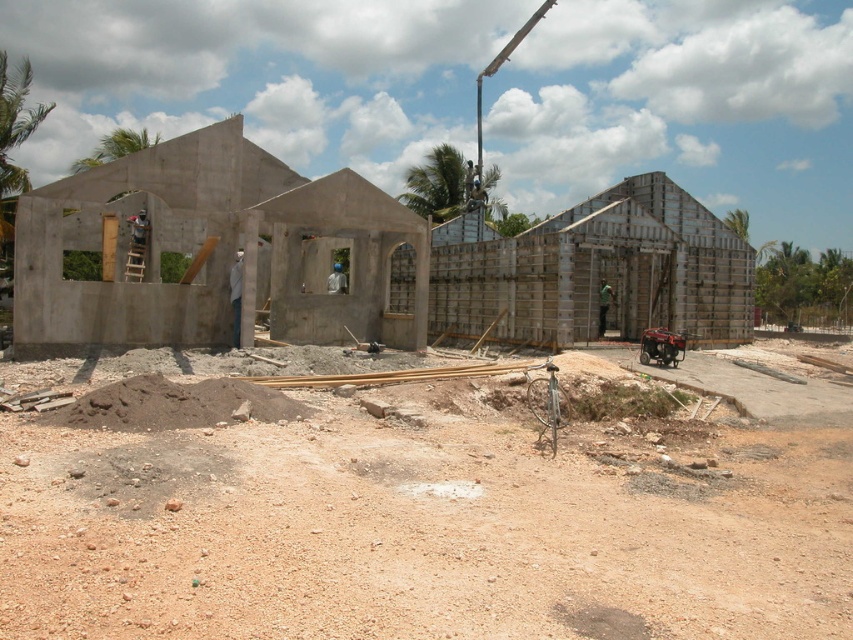
You are a construction worker who needs to move a heavy equipment from the brown gravel at lower center to the smooth concrete building at center. Considering the size of the gravel and the building, which location would provide a more stable base for the equipment?

The smooth concrete building at center is larger than the brown gravel at lower center, so the equipment would be more stable on the smooth concrete building at center.

You are a delivery driver who needs to park your truck near the construction site. The truck requires a flat, stable area free of loose materials. Based on the scene, where should you park your truck to avoid the brown gravel at lower center and the green fabric construction worker at center?

The green fabric construction worker at center is smaller than the brown gravel at lower center. Therefore, parking near the green fabric construction worker at center would provide a flatter and more stable area since it occupies less space and the gravel is larger and possibly looser.